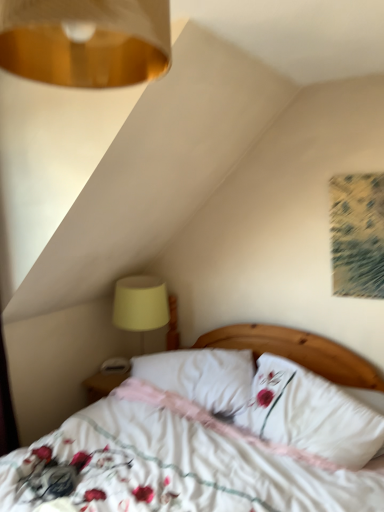
Question: Can you confirm if gold metallic lampshade at upper left is shorter than white soft pillow at center, the 2th pillow from the left?

Choices:
 (A) yes
 (B) no

Answer: (A)

Question: From a real-world perspective, is gold metallic lampshade at upper left located beneath white soft pillow at center, the 1th pillow positioned from the right?

Choices:
 (A) yes
 (B) no

Answer: (B)

Question: Is gold metallic lampshade at upper left at the left side of white soft pillow at center, the 2th pillow from the left?

Choices:
 (A) yes
 (B) no

Answer: (A)

Question: Would you consider gold metallic lampshade at upper left to be distant from white soft pillow at center, the 2th pillow from the left?

Choices:
 (A) no
 (B) yes

Answer: (B)

Question: Can you confirm if gold metallic lampshade at upper left is smaller than white soft pillow at center, the 2th pillow from the left?

Choices:
 (A) yes
 (B) no

Answer: (A)

Question: Is white soft pillow at center, the 2th pillow from the left, taller or shorter than yellow fabric lampshade at lower left?

Choices:
 (A) tall
 (B) short

Answer: (A)

Question: Considering the positions of white soft pillow at center, the 1th pillow positioned from the right, and yellow fabric lampshade at lower left in the image, is white soft pillow at center, the 1th pillow positioned from the right, wider or thinner than yellow fabric lampshade at lower left?

Choices:
 (A) wide
 (B) thin

Answer: (B)

Question: Is white soft pillow at center, the 1th pillow positioned from the right, inside the boundaries of yellow fabric lampshade at lower left, or outside?

Choices:
 (A) inside
 (B) outside

Answer: (B)

Question: Is white soft pillow at center, the 1th pillow positioned from the right, bigger or smaller than yellow fabric lampshade at lower left?

Choices:
 (A) big
 (B) small

Answer: (A)

Question: In the image, is white soft pillow at center, the 2th pillow from the left, on the left side or the right side of white floral fabric bed at center?

Choices:
 (A) right
 (B) left

Answer: (A)

Question: Considering the positions of white soft pillow at center, the 2th pillow from the left, and white floral fabric bed at center in the image, is white soft pillow at center, the 2th pillow from the left, taller or shorter than white floral fabric bed at center?

Choices:
 (A) short
 (B) tall

Answer: (A)

Question: Is point pyautogui.click(x=349, y=407) positioned closer to the camera than point pyautogui.click(x=225, y=333)?

Choices:
 (A) closer
 (B) farther

Answer: (A)

Question: Is white soft pillow at center, the 2th pillow from the left, situated inside white floral fabric bed at center or outside?

Choices:
 (A) outside
 (B) inside

Answer: (B)

Question: Is yellow fabric lampshade at lower left situated inside gold metallic lampshade at upper left or outside?

Choices:
 (A) inside
 (B) outside

Answer: (B)

Question: From a real-world perspective, is yellow fabric lampshade at lower left positioned above or below gold metallic lampshade at upper left?

Choices:
 (A) below
 (B) above

Answer: (A)